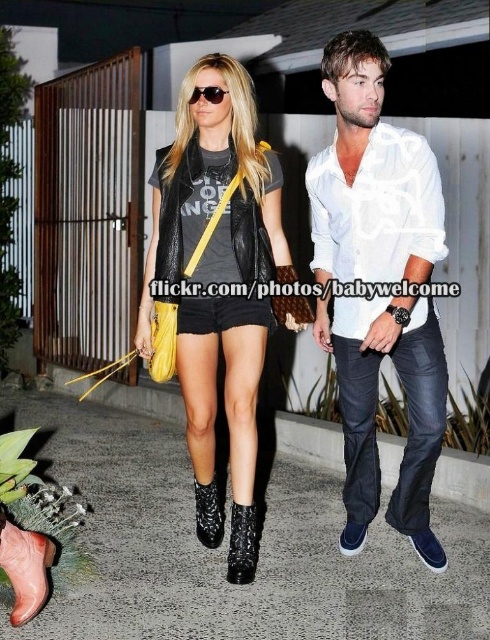
You are a photographer trying to capture a closeup of the dark blue denim jeans at center and the black quilted leather cowboy boot at lower center. Which one can you focus on without adjusting your camera focus?

The dark blue denim jeans at center is closer to the viewer than the black quilted leather cowboy boot at lower center, so you can focus on the dark blue denim jeans at center without adjusting your camera focus.